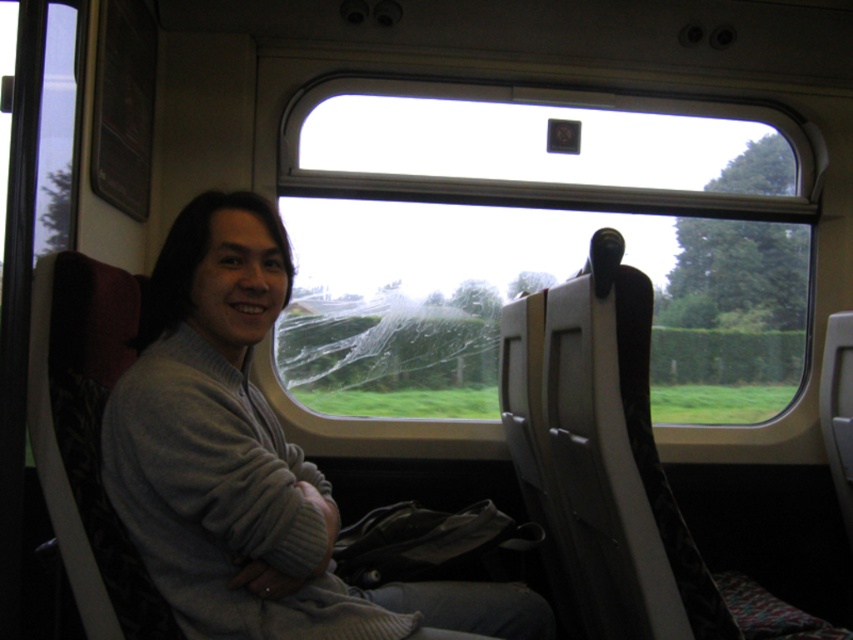
Question: Observing the image, what is the correct spatial positioning of transparent glass train window at center in reference to gray knitwear at center?

Choices:
 (A) below
 (B) above

Answer: (B)

Question: Does transparent glass train window at center have a greater width compared to gray knitwear at center?

Choices:
 (A) yes
 (B) no

Answer: (A)

Question: Which point is closer to the camera?

Choices:
 (A) [x=473, y=298]
 (B) [x=305, y=580]

Answer: (B)

Question: Among these points, which one is farthest from the camera?

Choices:
 (A) (206, 557)
 (B) (331, 401)

Answer: (B)

Question: Which point is farther to the camera?

Choices:
 (A) (125, 372)
 (B) (399, 230)

Answer: (B)

Question: Is transparent glass train window at center to the left of gray knitwear at center from the viewer's perspective?

Choices:
 (A) no
 (B) yes

Answer: (A)